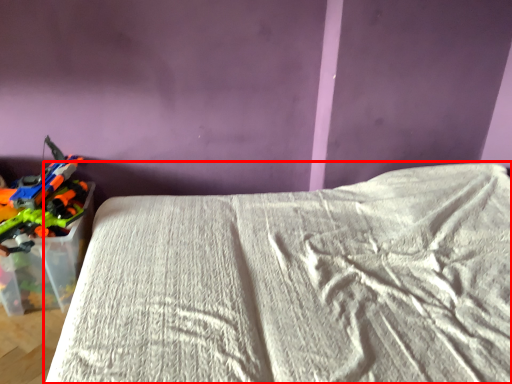
Question: In this image, where is bed (annotated by the red box) located relative to toy?

Choices:
 (A) right
 (B) left

Answer: (A)